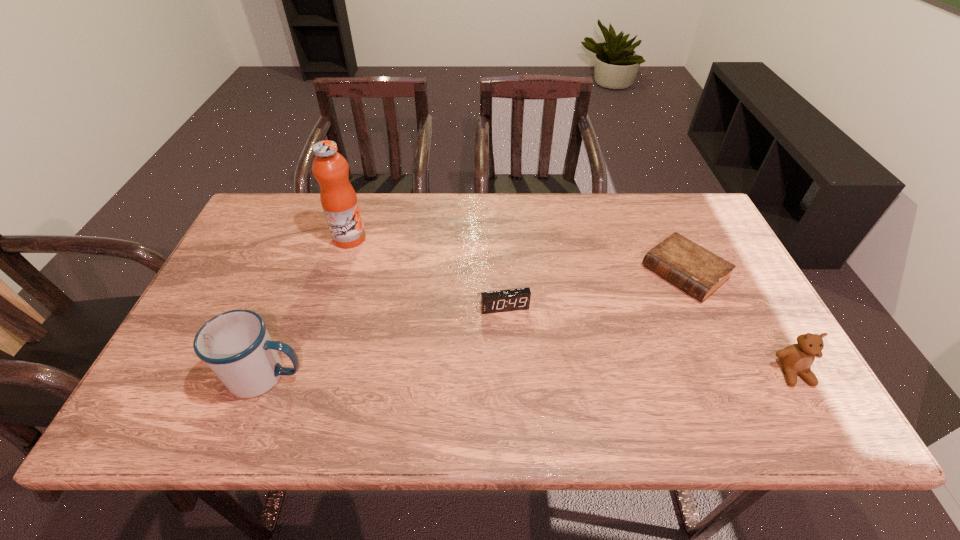
Image resolution: width=960 pixels, height=540 pixels. I want to click on object that is the fourth closest one to the mug, so click(797, 358).

Locate which object is the third closest to the third object from right to left. Please provide its 2D coordinates. Your answer should be formatted as a tuple, i.e. [(x, y)], where the tuple contains the x and y coordinates of a point satisfying the conditions above.

[(235, 345)]

Find the location of a particular element. Image resolution: width=960 pixels, height=540 pixels. free space that satisfies the following two spatial constraints: 1. on the front side of the fourth tallest object; 2. on the right side of the fruit juice is located at coordinates (328, 307).

The width and height of the screenshot is (960, 540). I want to click on free spot that satisfies the following two spatial constraints: 1. on the front side of the shortest object; 2. on the left side of the tallest object, so click(339, 273).